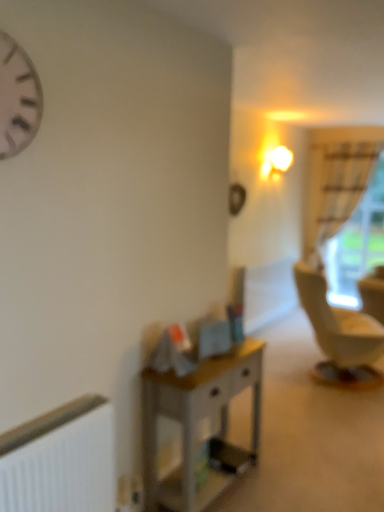
Question: From a real-world perspective, is wooden desk at center above or below white sheer curtain at right?

Choices:
 (A) below
 (B) above

Answer: (A)

Question: Based on their sizes in the image, would you say wooden desk at center is bigger or smaller than white sheer curtain at right?

Choices:
 (A) big
 (B) small

Answer: (B)

Question: Considering the real-world distances, which object is farthest from the white sheer curtain at right?

Choices:
 (A) white matte radiator at lower left
 (B) wooden desk at center
 (C) white matte clock at upper left

Answer: (C)

Question: Which is farther from the white matte radiator at lower left?

Choices:
 (A) white matte clock at upper left
 (B) wooden desk at center
 (C) white sheer curtain at right

Answer: (C)